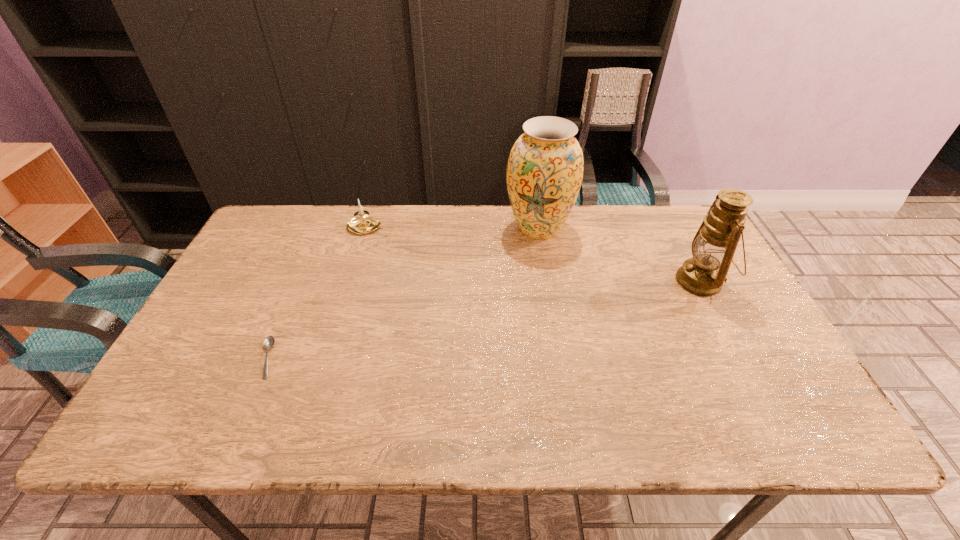
Where is `vacant space that's between the vase and the shortest object`? This screenshot has width=960, height=540. vacant space that's between the vase and the shortest object is located at coordinates (403, 293).

Locate an element on the screen. Image resolution: width=960 pixels, height=540 pixels. free space between the third farthest object and the third object from left to right is located at coordinates (619, 255).

In order to click on vacant space that is in between the second object from left to right and the rightmost object in this screenshot , I will do `click(534, 254)`.

What are the coordinates of `free spot between the leftmost object and the second shortest object` in the screenshot? It's located at click(317, 293).

Where is `unoccupied position between the leftmost object and the rightmost object`? The image size is (960, 540). unoccupied position between the leftmost object and the rightmost object is located at coordinates (484, 320).

The image size is (960, 540). I want to click on unoccupied position between the third object from left to right and the second object from left to right, so click(452, 228).

The width and height of the screenshot is (960, 540). In order to click on vacant area between the second shortest object and the vase in this screenshot , I will do `click(452, 228)`.

Find the location of a particular element. vacant point located between the leftmost object and the third object from left to right is located at coordinates (403, 293).

I want to click on free spot between the second object from left to right and the second object from right to left, so click(x=452, y=228).

At what (x,y) coordinates should I click in order to perform the action: click on object that can be found as the closest to the shortest object. Please return your answer as a coordinate pair (x, y). Looking at the image, I should click on (361, 224).